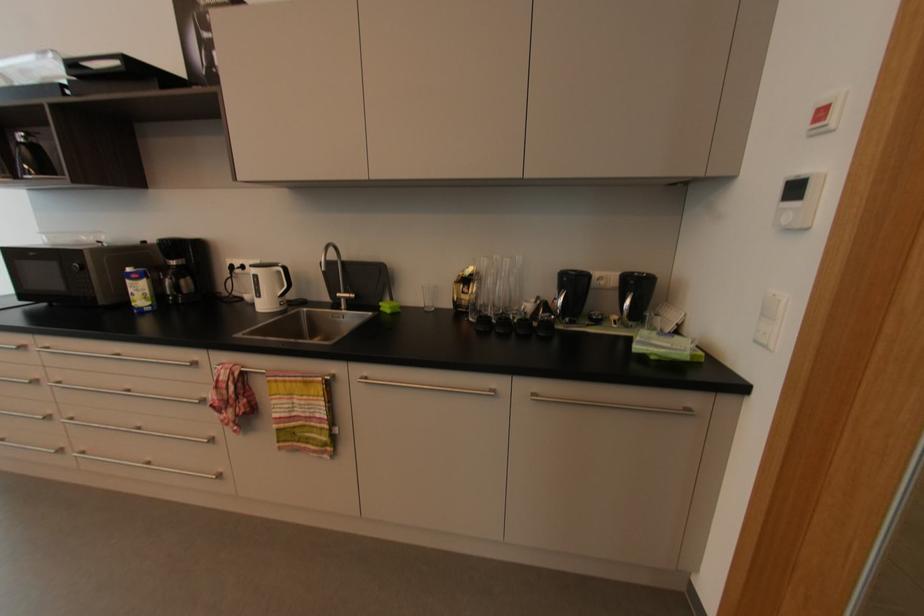
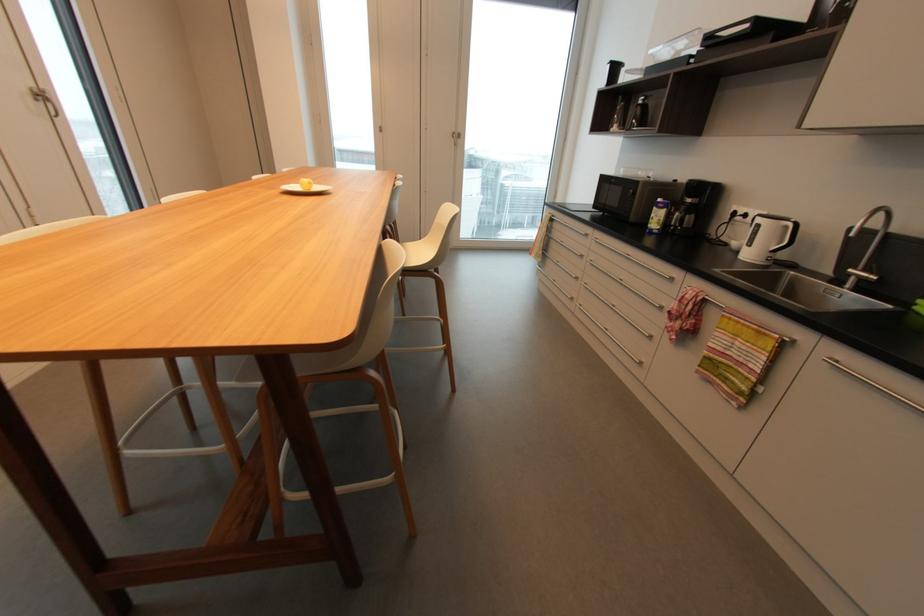
In the second image, find the point that corresponds to [342,294] in the first image.

(854, 270)